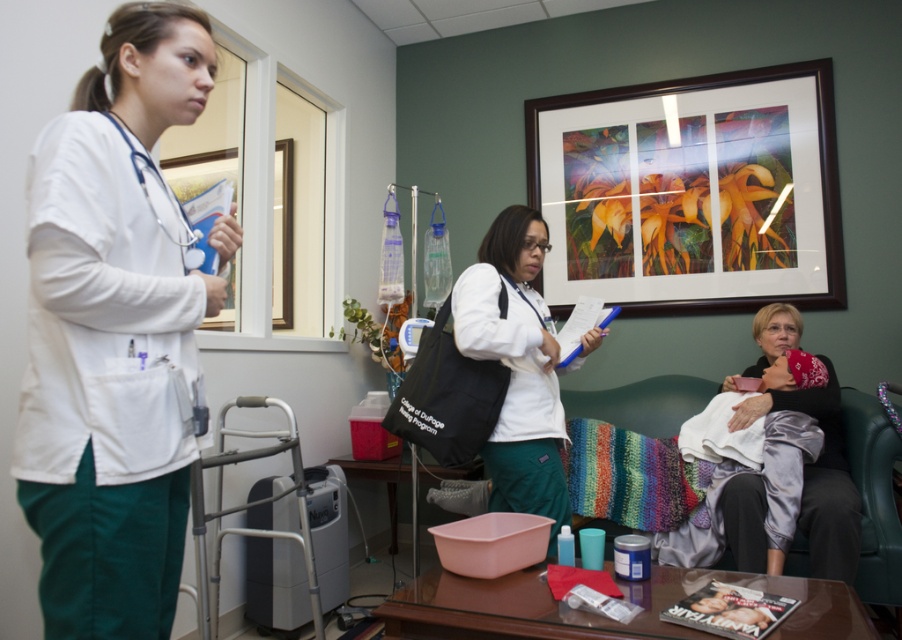
Does silky satin robe at lower right have a smaller size compared to white matte stethoscope at left?

No.

Between point (732, 508) and point (134, 147), which one is positioned in front?

Point (134, 147)

Does point (759, 336) come closer to viewer compared to point (190, 234)?

No.

This screenshot has height=640, width=902. Identify the location of silky satin robe at lower right. (818, 476).

Can you confirm if white smooth uniform at left is positioned above white matte coat at center?

Yes.

Is point (134, 280) positioned after point (512, 292)?

That is False.

This screenshot has width=902, height=640. Identify the location of white smooth uniform at left. (112, 333).

Between white smooth uniform at left and silky satin robe at lower right, which one appears on the left side from the viewer's perspective?

white smooth uniform at left

Identify the location of white smooth uniform at left. This screenshot has width=902, height=640. (112, 333).

Where is `white smooth uniform at left`? The image size is (902, 640). white smooth uniform at left is located at coordinates (112, 333).